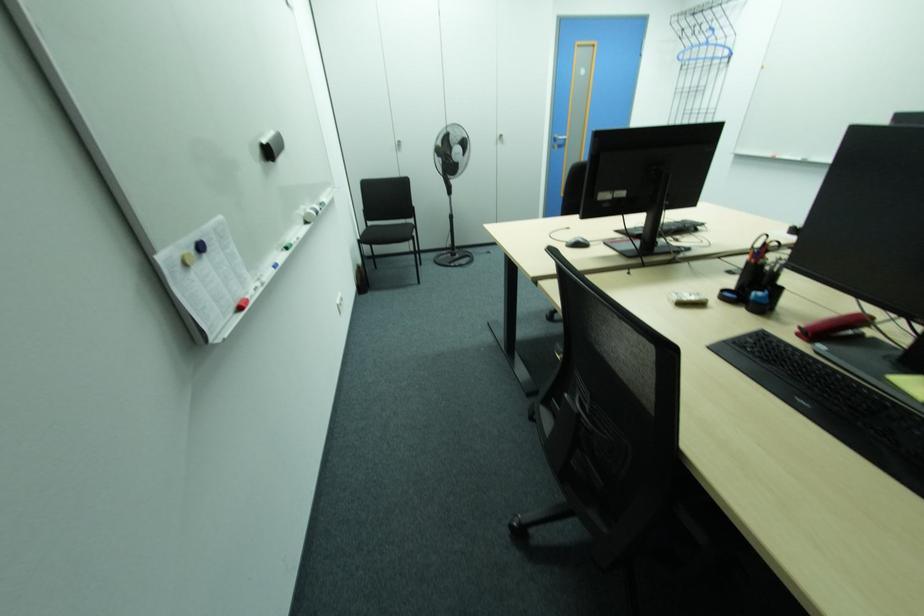
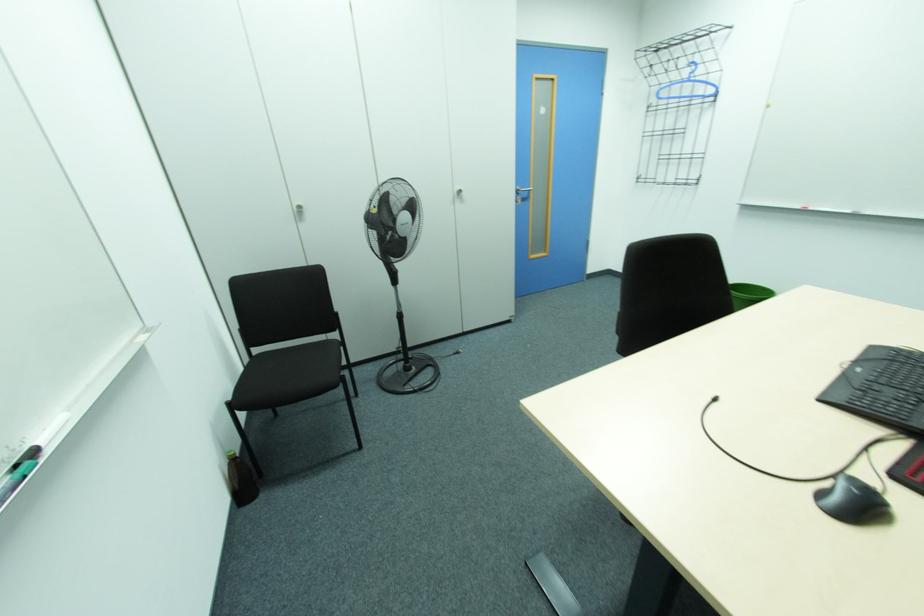
Question: In a continuous first-person perspective shot, in which direction is the camera moving?

Choices:
 (A) Left
 (B) Right
 (C) Forward
 (D) Backward

Answer: (C)